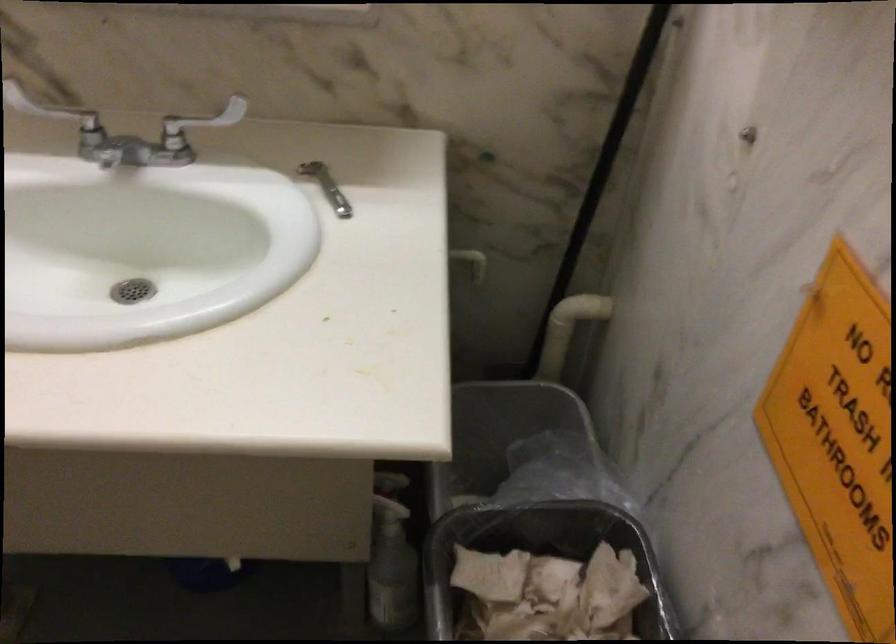
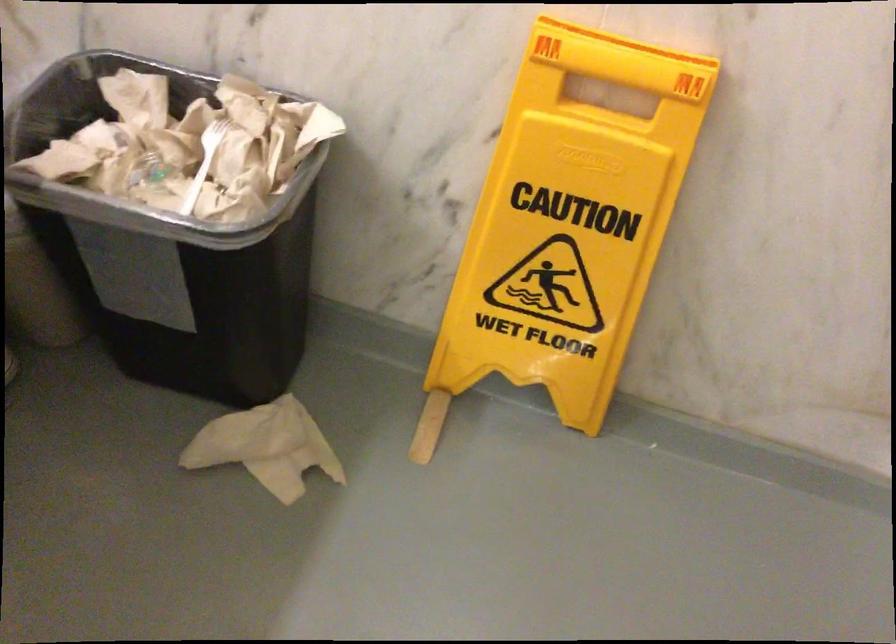
The images are taken continuously from a first-person perspective. In which direction is your viewpoint rotating?

The camera's rotation is toward right-down.